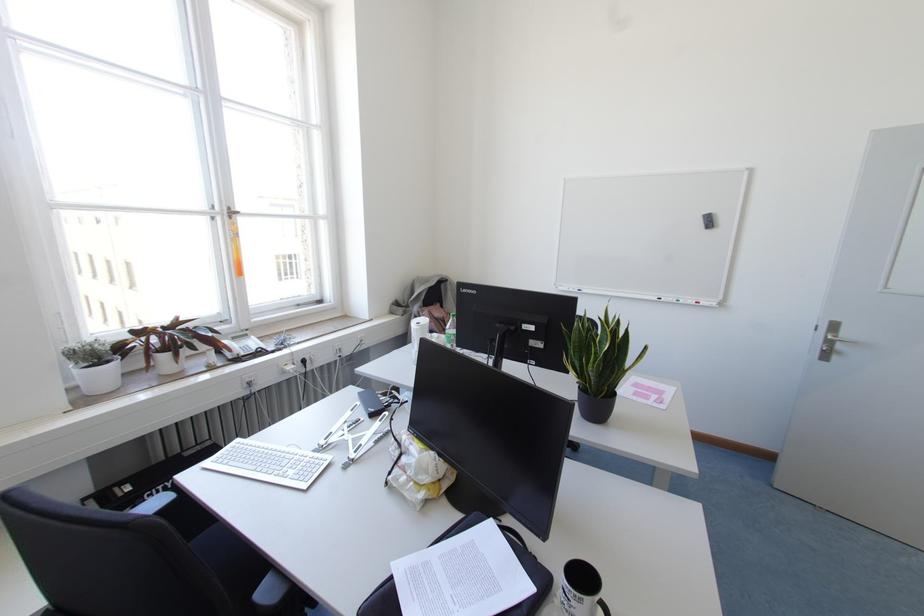
What do you see at coordinates (520, 561) in the screenshot?
I see `the black chair armrest` at bounding box center [520, 561].